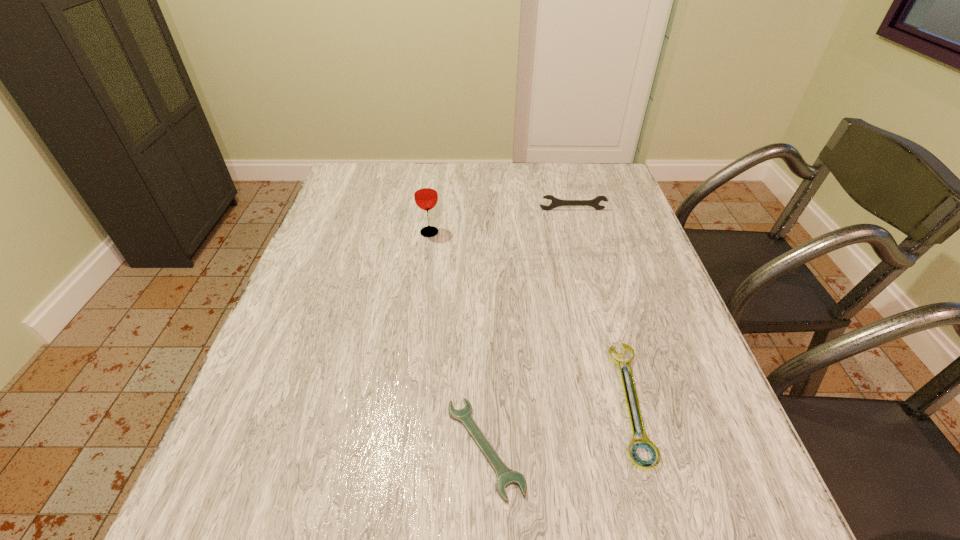
The image size is (960, 540). Identify the location of free space at the left edge of the desktop. (348, 233).

Where is `vacant space at the right edge`? Image resolution: width=960 pixels, height=540 pixels. vacant space at the right edge is located at coordinates (715, 443).

You are a GUI agent. You are given a task and a screenshot of the screen. Output one action in this format:
    pyautogui.click(x=<x>, y=<y>)
    Task: Click on the vacant region at the far left corner
    This screenshot has width=960, height=540.
    Given the screenshot: What is the action you would take?
    pyautogui.click(x=366, y=199)

In the image, there is a desktop. Where is `free space at the far right corner`? free space at the far right corner is located at coordinates (615, 184).

Identify the location of vacant space at the near right corner of the desktop. The image size is (960, 540). (743, 492).

Identify the location of unoccupied position between the third object from right to left and the tallest wrench. (529, 328).

You are a GUI agent. You are given a task and a screenshot of the screen. Output one action in this format:
    pyautogui.click(x=<x>, y=<y>)
    Task: Click on the free spot between the tallest object and the leftmost wrench
    The image size is (960, 540).
    Given the screenshot: What is the action you would take?
    pyautogui.click(x=457, y=340)

In order to click on vacant space that's between the second farthest object and the second tallest object in this screenshot , I will do `click(501, 221)`.

Identify the location of free space between the third shortest object and the leftmost wrench. (529, 328).

This screenshot has width=960, height=540. I want to click on free space between the farthest wrench and the glass, so click(501, 221).